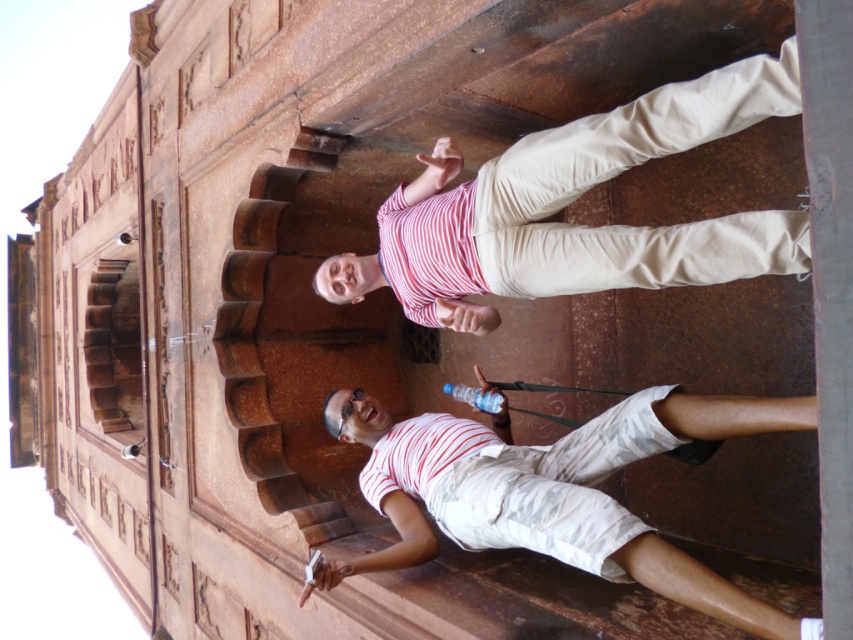
You are a photographer trying to capture the striped cotton shirt at center and the white cotton shorts at lower right in a single frame. Based on their positions, which of the two items is closer to the camera?

The striped cotton shirt at center is closer to the camera because the white cotton shorts at lower right is behind it.

You are trying to locate the striped cotton shirt at center in the image. What are its coordinates?

The striped cotton shirt at center is located at coordinates (572, 200).

You are a photographer trying to capture a clear shot of the striped cotton shirt at center and the white cotton shorts at lower right. Which clothing item is covering part of the other?

The striped cotton shirt at center is positioned over the white cotton shorts at lower right, so it is covering part of the white cotton shorts at lower right.